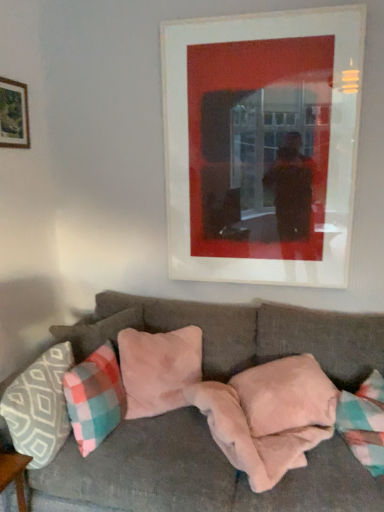
Describe the element at coordinates (286, 396) in the screenshot. The image size is (384, 512). I see `pink plush pillow at center, the fifth pillow when ordered from left to right` at that location.

What is the approximate width of pink plush pillow at center, arranged as the 1th pillow when viewed from the right?

15.30 inches.

What do you see at coordinates (39, 407) in the screenshot? Image resolution: width=384 pixels, height=512 pixels. I see `patterned fabric pillow at left, the 5th pillow when ordered from right to left` at bounding box center [39, 407].

Based on the photo, measure the distance between matte white picture frame at upper center, acting as the 1th picture frame starting from the right, and camera.

A distance of 2.04 meters exists between matte white picture frame at upper center, acting as the 1th picture frame starting from the right, and camera.

What do you see at coordinates (199, 473) in the screenshot? Image resolution: width=384 pixels, height=512 pixels. I see `velvet gray couch at center` at bounding box center [199, 473].

Locate an element on the screen. This screenshot has width=384, height=512. wooden frame at upper left, which ranks as the 2th picture frame in right-to-left order is located at coordinates (14, 114).

Identify the location of plaid fabric pillow at lower left, which is the third pillow in left-to-right order. Image resolution: width=384 pixels, height=512 pixels. (95, 398).

The height and width of the screenshot is (512, 384). Identify the location of pink plush pillow at center, the fifth pillow when ordered from left to right. (286, 396).

Where is `the 3rd pillow located beneath the matte white picture frame at upper center, acting as the 1th picture frame starting from the right (from a real-world perspective)`? This screenshot has height=512, width=384. the 3rd pillow located beneath the matte white picture frame at upper center, acting as the 1th picture frame starting from the right (from a real-world perspective) is located at coordinates (158, 369).

Is matte white picture frame at upper center, acting as the 1th picture frame starting from the right, not near suede-like beige pillow at center, the second pillow from the right?

No, matte white picture frame at upper center, acting as the 1th picture frame starting from the right, is not far away from suede-like beige pillow at center, the second pillow from the right.

Who is bigger, matte white picture frame at upper center, acting as the 1th picture frame starting from the right, or suede-like beige pillow at center, marked as the 4th pillow in a left-to-right arrangement?

suede-like beige pillow at center, marked as the 4th pillow in a left-to-right arrangement, is bigger.

Looking at this image, considering the relative sizes of matte white picture frame at upper center, arranged as the second picture frame when viewed from the left, and suede-like beige pillow at center, the second pillow from the right, in the image provided, is matte white picture frame at upper center, arranged as the second picture frame when viewed from the left, wider than suede-like beige pillow at center, the second pillow from the right,?

No.

Is suede-like beige pillow at center, marked as the 4th pillow in a left-to-right arrangement, positioned with its back to matte white picture frame at upper center, arranged as the second picture frame when viewed from the left?

That's not correct — suede-like beige pillow at center, marked as the 4th pillow in a left-to-right arrangement, is not looking away from matte white picture frame at upper center, arranged as the second picture frame when viewed from the left.

Would you say suede-like beige pillow at center, marked as the 4th pillow in a left-to-right arrangement, is a long distance from matte white picture frame at upper center, arranged as the second picture frame when viewed from the left?

No, suede-like beige pillow at center, marked as the 4th pillow in a left-to-right arrangement, is in close proximity to matte white picture frame at upper center, arranged as the second picture frame when viewed from the left.

Considering the positions of point (161, 412) and point (324, 224), is point (161, 412) closer or farther from the camera than point (324, 224)?

Point (161, 412) is positioned closer to the camera compared to point (324, 224).

You are a GUI agent. You are given a task and a screenshot of the screen. Output one action in this format:
    pyautogui.click(x=<x>, y=<y>)
    Task: Click on the studio couch that appears on the right of plaid fabric pillow at lower left, which is the third pillow in left-to-right order
    
    Given the screenshot: What is the action you would take?
    pyautogui.click(x=199, y=473)

From the image's perspective, does plaid fabric pillow at lower left, which is the third pillow in left-to-right order, appear lower than velvet gray couch at center?

Actually, plaid fabric pillow at lower left, which is the third pillow in left-to-right order, appears above velvet gray couch at center in the image.

Is plaid fabric pillow at lower left, which is the third pillow in left-to-right order, touching velvet gray couch at center?

No, plaid fabric pillow at lower left, which is the third pillow in left-to-right order, is not beside velvet gray couch at center.

Is patterned fabric pillow at left, the 5th pillow when ordered from right to left, next to plaid fabric pillow at lower left, which is the third pillow in left-to-right order?

There is a gap between patterned fabric pillow at left, the 5th pillow when ordered from right to left, and plaid fabric pillow at lower left, which is the third pillow in left-to-right order.

Which is correct: patterned fabric pillow at left, placed as the 1th pillow when sorted from left to right, is inside plaid fabric pillow at lower left, the third pillow from the right, or outside of it?

patterned fabric pillow at left, placed as the 1th pillow when sorted from left to right, is located beyond the bounds of plaid fabric pillow at lower left, the third pillow from the right.

Is patterned fabric pillow at left, placed as the 1th pillow when sorted from left to right, positioned in front of plaid fabric pillow at lower left, the third pillow from the right?

Yes.

Is matte white picture frame at upper center, acting as the 1th picture frame starting from the right, aimed at pink suede pillow at center, positioned as the 2th pillow in left-to-right order?

No.

From their relative heights in the image, would you say matte white picture frame at upper center, arranged as the second picture frame when viewed from the left, is taller or shorter than pink suede pillow at center, positioned as the 2th pillow in left-to-right order?

Considering their sizes, matte white picture frame at upper center, arranged as the second picture frame when viewed from the left, has more height than pink suede pillow at center, positioned as the 2th pillow in left-to-right order.

From the image's perspective, which one is positioned lower, matte white picture frame at upper center, arranged as the second picture frame when viewed from the left, or pink suede pillow at center, marked as the fourth pillow in a right-to-left arrangement?

pink suede pillow at center, marked as the fourth pillow in a right-to-left arrangement, from the image's perspective.

Is plaid fabric pillow at lower left, which is the third pillow in left-to-right order, facing away from pink suede pillow at center, positioned as the 2th pillow in left-to-right order?

Correct, plaid fabric pillow at lower left, which is the third pillow in left-to-right order, is looking away from pink suede pillow at center, positioned as the 2th pillow in left-to-right order.

Can we say plaid fabric pillow at lower left, which is the third pillow in left-to-right order, lies outside pink suede pillow at center, positioned as the 2th pillow in left-to-right order?

Absolutely, plaid fabric pillow at lower left, which is the third pillow in left-to-right order, is external to pink suede pillow at center, positioned as the 2th pillow in left-to-right order.

Locate an element on the screen. This screenshot has height=512, width=384. the 2nd pillow above when counting from the plaid fabric pillow at lower left, the third pillow from the right (from the image's perspective) is located at coordinates (98, 331).

Which of these two, plaid fabric pillow at lower left, which is the third pillow in left-to-right order, or pink suede pillow at center, positioned as the 2th pillow in left-to-right order, is thinner?

Thinner between the two is pink suede pillow at center, positioned as the 2th pillow in left-to-right order.

Is suede-like beige pillow at center, the second pillow from the right, closer to the viewer compared to pink suede pillow at center, positioned as the 2th pillow in left-to-right order?

Yes, it is in front of pink suede pillow at center, positioned as the 2th pillow in left-to-right order.

Which of these two, suede-like beige pillow at center, marked as the 4th pillow in a left-to-right arrangement, or pink suede pillow at center, marked as the fourth pillow in a right-to-left arrangement, is bigger?

suede-like beige pillow at center, marked as the 4th pillow in a left-to-right arrangement, is bigger.

Can you confirm if suede-like beige pillow at center, the second pillow from the right, is positioned to the right of pink suede pillow at center, positioned as the 2th pillow in left-to-right order?

Yes, suede-like beige pillow at center, the second pillow from the right, is to the right of pink suede pillow at center, positioned as the 2th pillow in left-to-right order.

Which object is thinner, suede-like beige pillow at center, marked as the 4th pillow in a left-to-right arrangement, or pink suede pillow at center, positioned as the 2th pillow in left-to-right order?

With smaller width is pink suede pillow at center, positioned as the 2th pillow in left-to-right order.

Identify the location of the 3rd pillow positioned below the matte white picture frame at upper center, arranged as the second picture frame when viewed from the left (from a real-world perspective). The height and width of the screenshot is (512, 384). (158, 369).

The image size is (384, 512). Find the location of `picture frame that is the 1st one above the suede-like beige pillow at center, marked as the 4th pillow in a left-to-right arrangement (from a real-world perspective)`. picture frame that is the 1st one above the suede-like beige pillow at center, marked as the 4th pillow in a left-to-right arrangement (from a real-world perspective) is located at coordinates pos(262,145).

Estimate the real-world distances between objects in this image. Which object is closer to matte white picture frame at upper center, arranged as the second picture frame when viewed from the left, fuzzy pink blanket at lower center or patterned fabric pillow at left, the 5th pillow when ordered from right to left?

fuzzy pink blanket at lower center.

Which object lies nearer to the anchor point wooden frame at upper left, which ranks as the 2th picture frame in right-to-left order, plaid fabric pillow at lower left, which is the third pillow in left-to-right order, or suede-like beige pillow at center, the second pillow from the right?

plaid fabric pillow at lower left, which is the third pillow in left-to-right order, lies closer to wooden frame at upper left, which ranks as the 2th picture frame in right-to-left order, than the other object.

Based on the photo, which object lies nearer to the anchor point plaid fabric pillow at lower left, which is the third pillow in left-to-right order, wooden frame at upper left, which ranks as the 2th picture frame in right-to-left order, or pink plush pillow at center, the fifth pillow when ordered from left to right?

pink plush pillow at center, the fifth pillow when ordered from left to right.

Consider the image. Which object lies nearer to the anchor point fuzzy pink blanket at lower center, matte white picture frame at upper center, arranged as the second picture frame when viewed from the left, or pink plush pillow at center, the fifth pillow when ordered from left to right?

pink plush pillow at center, the fifth pillow when ordered from left to right.

Looking at the image, which one is located closer to plaid fabric pillow at lower left, which is the third pillow in left-to-right order, fuzzy pink blanket at lower center or matte white picture frame at upper center, acting as the 1th picture frame starting from the right?

Based on the image, fuzzy pink blanket at lower center appears to be nearer to plaid fabric pillow at lower left, which is the third pillow in left-to-right order.

When comparing their distances from pink suede pillow at center, positioned as the 2th pillow in left-to-right order, does suede-like beige pillow at center, the second pillow from the right, or velvet gray couch at center seem closer?

suede-like beige pillow at center, the second pillow from the right, is positioned closer to the anchor pink suede pillow at center, positioned as the 2th pillow in left-to-right order.

When comparing their distances from velvet gray couch at center, does pink suede pillow at center, positioned as the 2th pillow in left-to-right order, or suede-like beige pillow at center, the second pillow from the right, seem further?

Among the two, suede-like beige pillow at center, the second pillow from the right, is located further to velvet gray couch at center.

Based on their spatial positions, is wooden frame at upper left, positioned as the 1th picture frame in left-to-right order, or matte white picture frame at upper center, acting as the 1th picture frame starting from the right, further from velvet gray couch at center?

The object further to velvet gray couch at center is wooden frame at upper left, positioned as the 1th picture frame in left-to-right order.

This screenshot has width=384, height=512. What are the coordinates of `pillow between matte white picture frame at upper center, arranged as the second picture frame when viewed from the left, and suede-like beige pillow at center, marked as the 4th pillow in a left-to-right arrangement, in the vertical direction` in the screenshot? It's located at (98, 331).

The image size is (384, 512). I want to click on pillow between wooden frame at upper left, which ranks as the 2th picture frame in right-to-left order, and suede-like beige pillow at center, marked as the 4th pillow in a left-to-right arrangement, in the up-down direction, so click(98, 331).

Find the location of a particular element. blanket between plaid fabric pillow at lower left, the third pillow from the right, and pink plush pillow at center, the fifth pillow when ordered from left to right is located at coordinates (252, 436).

Image resolution: width=384 pixels, height=512 pixels. What are the coordinates of `blanket between velvet gray couch at center and pink suede pillow at center, marked as the fourth pillow in a right-to-left arrangement, in the front-back direction` in the screenshot? It's located at (252, 436).